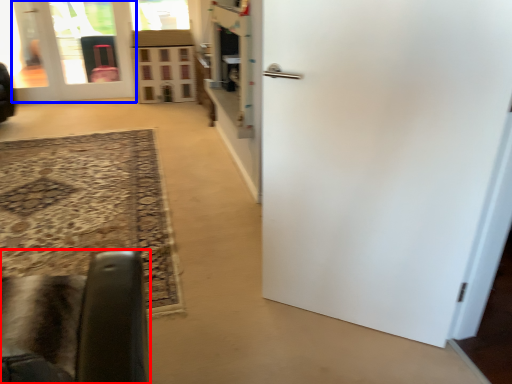
Question: Among these objects, which one is farthest to the camera, furniture (highlighted by a red box) or door (highlighted by a blue box)?

Choices:
 (A) furniture
 (B) door

Answer: (B)